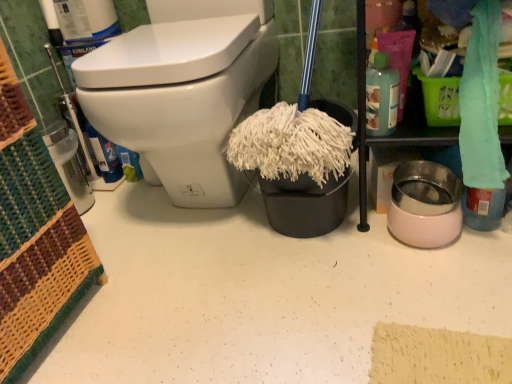
Find the location of `vacant space underneath white glossy toilet at upper left (from a real-world perspective)`. vacant space underneath white glossy toilet at upper left (from a real-world perspective) is located at coordinates (201, 217).